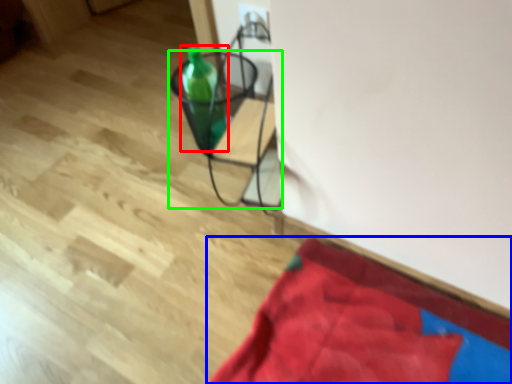
Question: Which object is positioned closest to bottle (highlighted by a red box)? Select from blanket (highlighted by a blue box) and furniture (highlighted by a green box).

Choices:
 (A) blanket
 (B) furniture

Answer: (B)